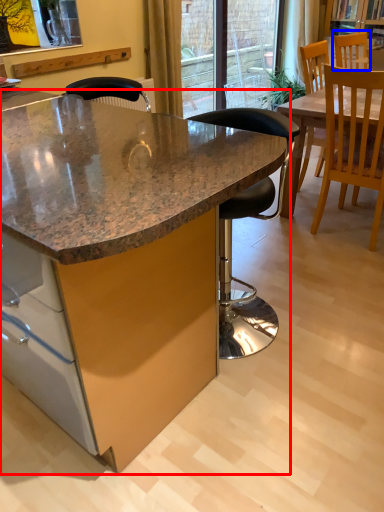
Question: Which object appears closest to the camera in this image, table (highlighted by a red box) or chair (highlighted by a blue box)?

Choices:
 (A) table
 (B) chair

Answer: (A)